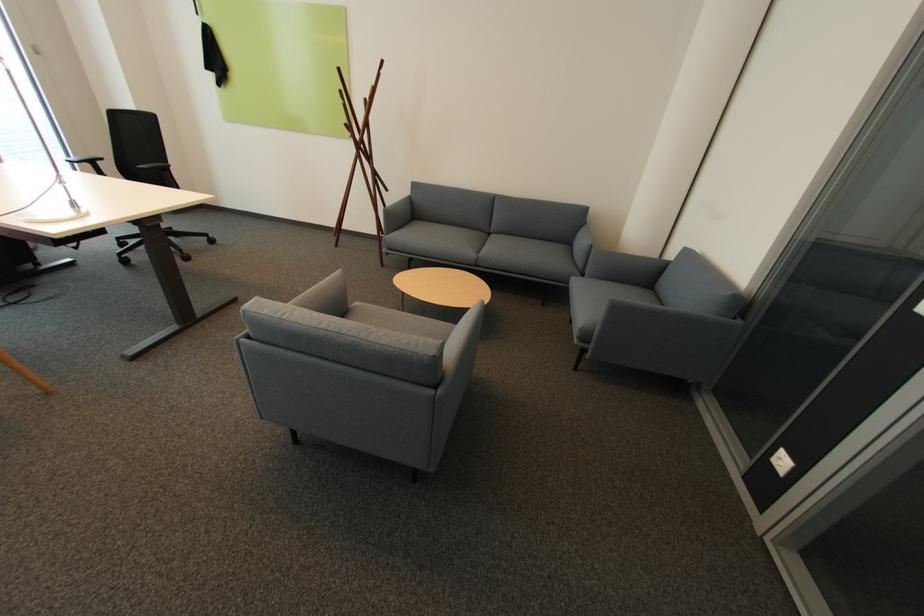
What do you see at coordinates (361, 156) in the screenshot?
I see `the wooden coat rack` at bounding box center [361, 156].